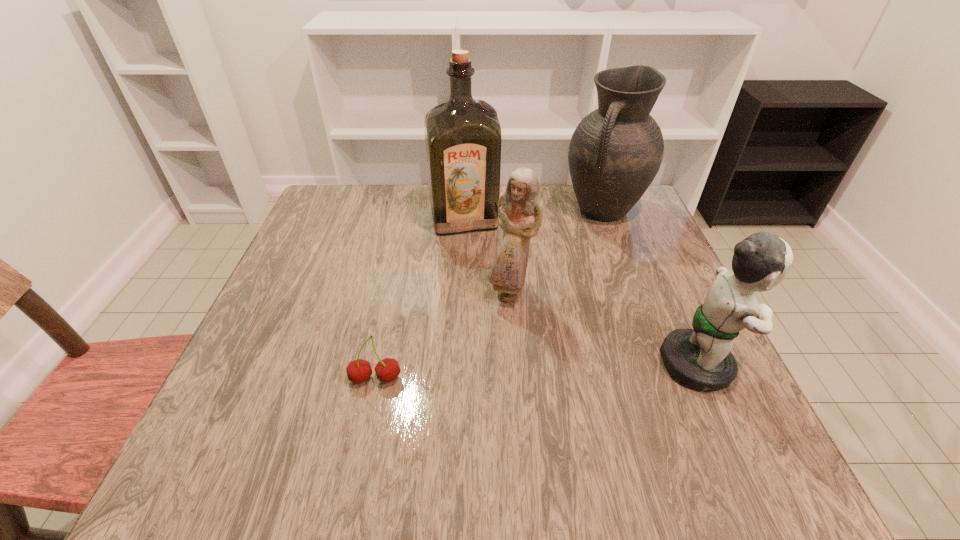
You are a GUI agent. You are given a task and a screenshot of the screen. Output one action in this format:
    pyautogui.click(x=<x>, y=<y>)
    Task: Click on the shortest object
    The image size is (960, 540).
    Given the screenshot: What is the action you would take?
    pyautogui.click(x=387, y=370)

Identify the location of the leftmost object. (387, 370).

In order to click on the right figurine in this screenshot , I will do `click(701, 358)`.

The width and height of the screenshot is (960, 540). Identify the location of liquor. (463, 138).

Find the location of `the left figurine`. the left figurine is located at coordinates (520, 209).

The image size is (960, 540). I want to click on the third nearest object, so click(520, 209).

Locate an element on the screen. This screenshot has width=960, height=540. the second tallest object is located at coordinates (615, 152).

The width and height of the screenshot is (960, 540). In order to click on vacant space situated on the surface of the leftmost object in this screenshot , I will do tap(366, 426).

Identify the location of vacant area situated 0.380m on the label of the liquor. The width and height of the screenshot is (960, 540). (502, 353).

Where is `free spot located on the label of the liquor`? The height and width of the screenshot is (540, 960). free spot located on the label of the liquor is located at coordinates point(474,254).